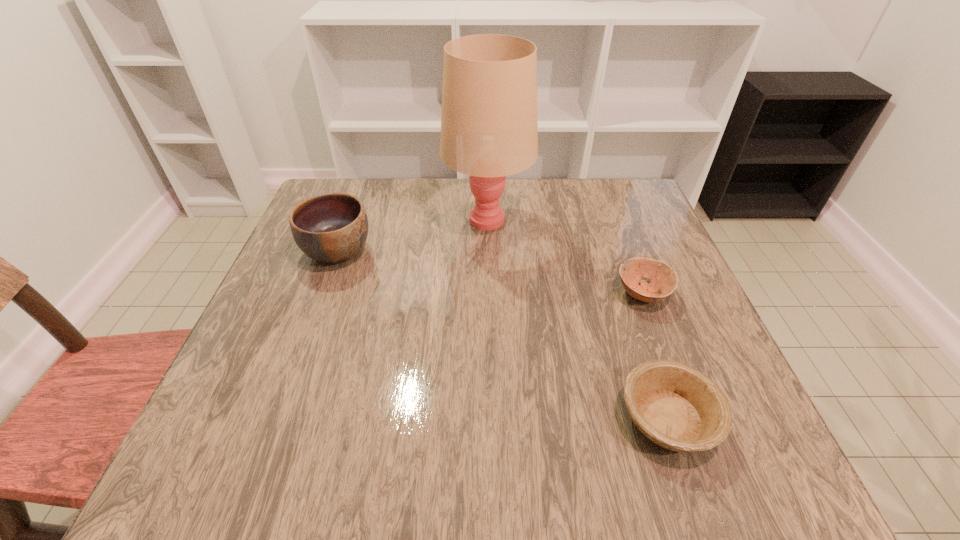
Where is `the third object from right to left`? This screenshot has width=960, height=540. the third object from right to left is located at coordinates (489, 130).

Find the location of a particular element. This screenshot has height=540, width=960. the tallest object is located at coordinates coord(489,130).

Find the location of a particular element. The width and height of the screenshot is (960, 540). the tallest bowl is located at coordinates (332, 228).

Where is `the leftmost object`? The image size is (960, 540). the leftmost object is located at coordinates (332, 228).

Locate an element on the screen. The height and width of the screenshot is (540, 960). the nearest bowl is located at coordinates (676, 406).

Identify the location of free point located 0.050m on the back of the lampshade. (487, 185).

The height and width of the screenshot is (540, 960). Find the location of `vacant space located on the back of the leftmost object`. vacant space located on the back of the leftmost object is located at coordinates (358, 196).

Locate an element on the screen. The image size is (960, 540). free spot located 0.260m on the back of the nearest object is located at coordinates (620, 279).

This screenshot has width=960, height=540. What are the coordinates of `object that is at the far edge` in the screenshot? It's located at (489, 130).

Image resolution: width=960 pixels, height=540 pixels. Identify the location of object present at the near edge. (676, 406).